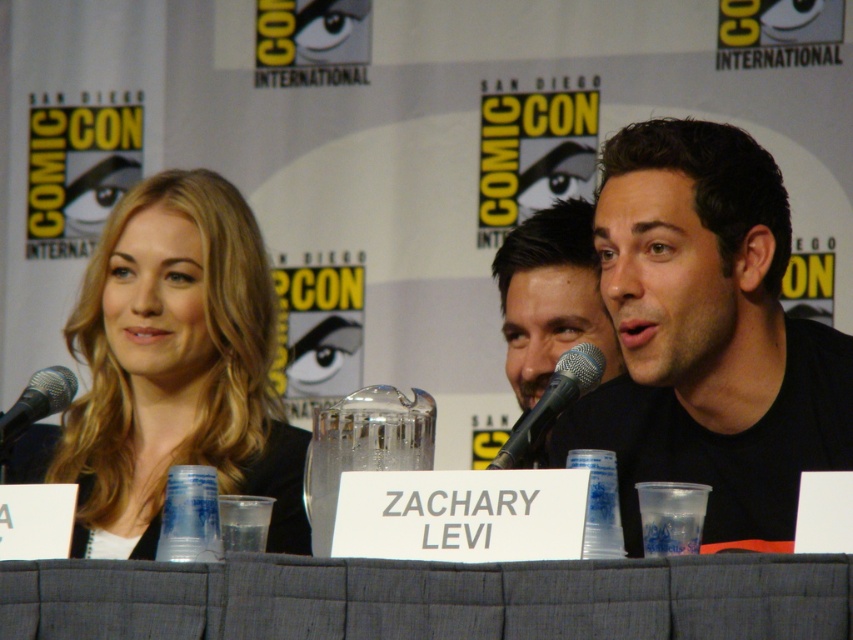
You are attending Comic Con and want to grab a drink from the gray fabric table at center. You are standing 7.43 feet away from it. If you can reach 2 feet, can you grab the drink without moving closer?

The gray fabric table at center is 7.43 feet away from you, and your reach is only 2 feet, so you cannot grab the drink without moving closer.

You are attending ComicCon and want to take a photo of the panelist with smooth blonde hair at center. Where should you position yourself relative to the table to capture their hair in the frame?

The smooth blonde hair at center is located at point (x=177, y=365), so you should position yourself directly in front of the table at the center to capture their hair in the frame.